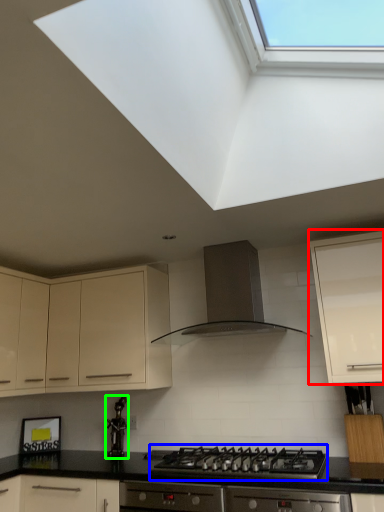
Question: Based on their relative distances, which object is farther from cabinetry (highlighted by a red box)? Choose from gas stove (highlighted by a blue box) and appliance (highlighted by a green box).

Choices:
 (A) gas stove
 (B) appliance

Answer: (B)